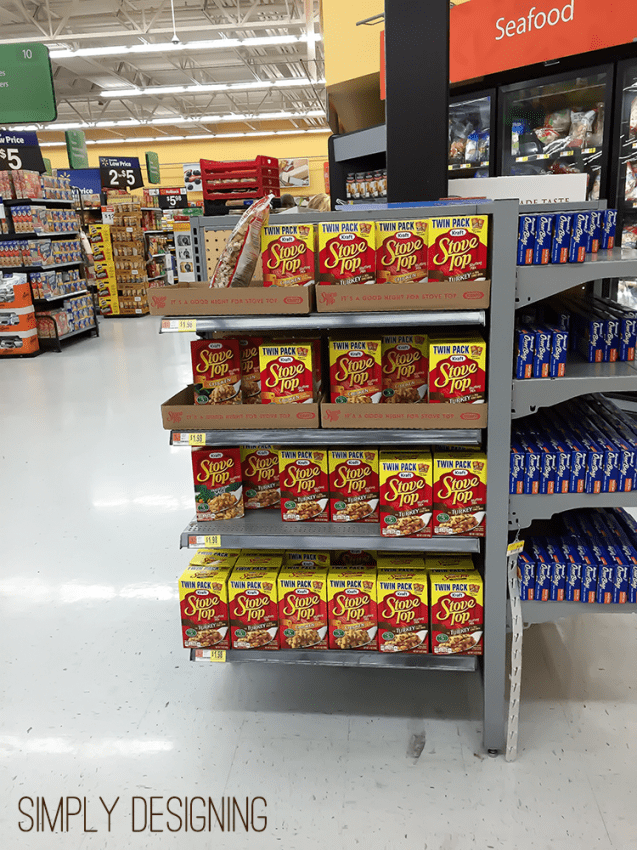
The width and height of the screenshot is (637, 850). Find the location of `ceiling lights`. ceiling lights is located at coordinates (236, 42), (244, 86), (241, 116), (217, 137).